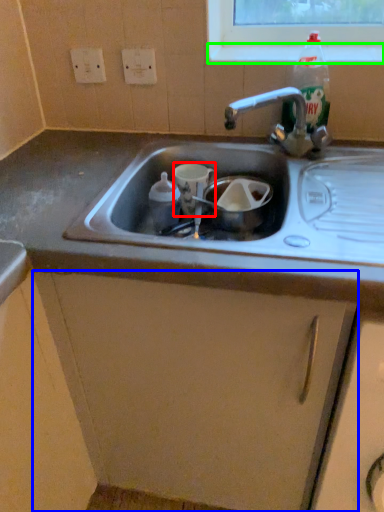
Question: Which is nearer to the cup (highlighted by a red box)? cabinetry (highlighted by a blue box) or window sill (highlighted by a green box).

Choices:
 (A) cabinetry
 (B) window sill

Answer: (B)